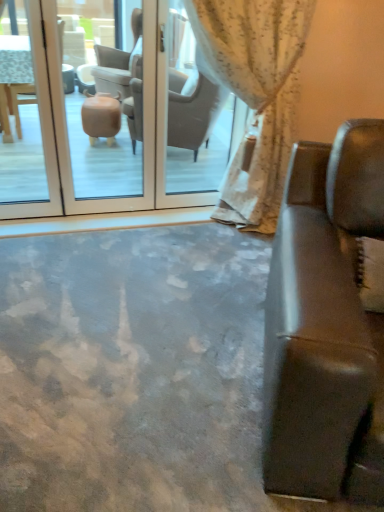
Find the location of a particular element. leather couch at right is located at coordinates (324, 324).

Is point (146, 74) less distant than point (228, 174)?

Yes, point (146, 74) is closer to viewer.

Based on the photo, would you say transparent glass door at center contains white floral fabric curtain at upper center?

No, white floral fabric curtain at upper center is located outside of transparent glass door at center.

Identify the location of curtain positioned vertically above the transparent glass door at center (from a real-world perspective). Image resolution: width=384 pixels, height=512 pixels. (255, 95).

Is there a large distance between transparent glass door at center and white floral fabric curtain at upper center?

That's not correct — transparent glass door at center is a little close to white floral fabric curtain at upper center.

The width and height of the screenshot is (384, 512). Find the location of `studio couch in front of the transparent glass door at center`. studio couch in front of the transparent glass door at center is located at coordinates (324, 324).

Is leather couch at right not near transparent glass door at center?

Yes, leather couch at right is far from transparent glass door at center.

Does leather couch at right appear on the right side of transparent glass door at center?

Correct, you'll find leather couch at right to the right of transparent glass door at center.

How many degrees apart are the facing directions of white floral fabric curtain at upper center and transparent glass door at center?

There is a 0.793-degree angle between the facing directions of white floral fabric curtain at upper center and transparent glass door at center.

Locate an element on the screen. This screenshot has width=384, height=512. screen door behind the white floral fabric curtain at upper center is located at coordinates (125, 119).

Is white floral fabric curtain at upper center next to transparent glass door at center?

No, white floral fabric curtain at upper center is not next to transparent glass door at center.

Considering the points (192, 28) and (134, 106), which point is in front, point (192, 28) or point (134, 106)?

The point (192, 28) is more forward.

Which object is closer to the camera, white floral fabric curtain at upper center or leather couch at right?

leather couch at right is in front.

How different are the orientations of white floral fabric curtain at upper center and leather couch at right in degrees?

There is a 24.4-degree angle between the facing directions of white floral fabric curtain at upper center and leather couch at right.

Could you tell me if white floral fabric curtain at upper center is turned towards leather couch at right?

Yes.

Between white floral fabric curtain at upper center and leather couch at right, which one has larger width?

Wider between the two is leather couch at right.

Is leather couch at right inside the boundaries of white floral fabric curtain at upper center, or outside?

leather couch at right is spatially situated outside white floral fabric curtain at upper center.

Between leather couch at right and white floral fabric curtain at upper center, which one has less height?

leather couch at right is shorter.

Identify the location of studio couch on the right of white floral fabric curtain at upper center. (324, 324).

From the image's perspective, is leather couch at right located above or below white floral fabric curtain at upper center?

Clearly, from the image's perspective, leather couch at right is below white floral fabric curtain at upper center.

Is transparent glass door at center spatially inside leather couch at right, or outside of it?

transparent glass door at center is not inside leather couch at right, it's outside.

What's the angular difference between transparent glass door at center and leather couch at right's facing directions?

The facing directions of transparent glass door at center and leather couch at right are 23.6 degrees apart.

Which object is thinner, transparent glass door at center or leather couch at right?

With smaller width is transparent glass door at center.

Considering the relative positions of transparent glass door at center and leather couch at right in the image provided, is transparent glass door at center to the right of leather couch at right from the viewer's perspective?

No, transparent glass door at center is not to the right of leather couch at right.

Where is `screen door above the white floral fabric curtain at upper center (from the image's perspective)`? screen door above the white floral fabric curtain at upper center (from the image's perspective) is located at coordinates (125, 119).

You are a GUI agent. You are given a task and a screenshot of the screen. Output one action in this format:
    pyautogui.click(x=<x>, y=<y>)
    Task: Click on the screen door above the leather couch at right (from a real-world perspective)
    The height and width of the screenshot is (512, 384).
    Given the screenshot: What is the action you would take?
    pyautogui.click(x=125, y=119)

From the image, which object appears to be nearer to transparent glass door at center, white floral fabric curtain at upper center or leather couch at right?

white floral fabric curtain at upper center.

Estimate the real-world distances between objects in this image. Which object is closer to transparent glass door at center, leather couch at right or white floral fabric curtain at upper center?

white floral fabric curtain at upper center is closer to transparent glass door at center.

From the picture: When comparing their distances from white floral fabric curtain at upper center, does transparent glass door at center or leather couch at right seem further?

leather couch at right.

Looking at the image, which one is located closer to leather couch at right, white floral fabric curtain at upper center or transparent glass door at center?

white floral fabric curtain at upper center lies closer to leather couch at right than the other object.

Based on the photo, based on their spatial positions, is leather couch at right or transparent glass door at center further from white floral fabric curtain at upper center?

Among the two, leather couch at right is located further to white floral fabric curtain at upper center.

From the image, which object appears to be nearer to leather couch at right, transparent glass door at center or white floral fabric curtain at upper center?

Based on the image, white floral fabric curtain at upper center appears to be nearer to leather couch at right.

This screenshot has height=512, width=384. In order to click on curtain between leather couch at right and transparent glass door at center from front to back in this screenshot , I will do (x=255, y=95).